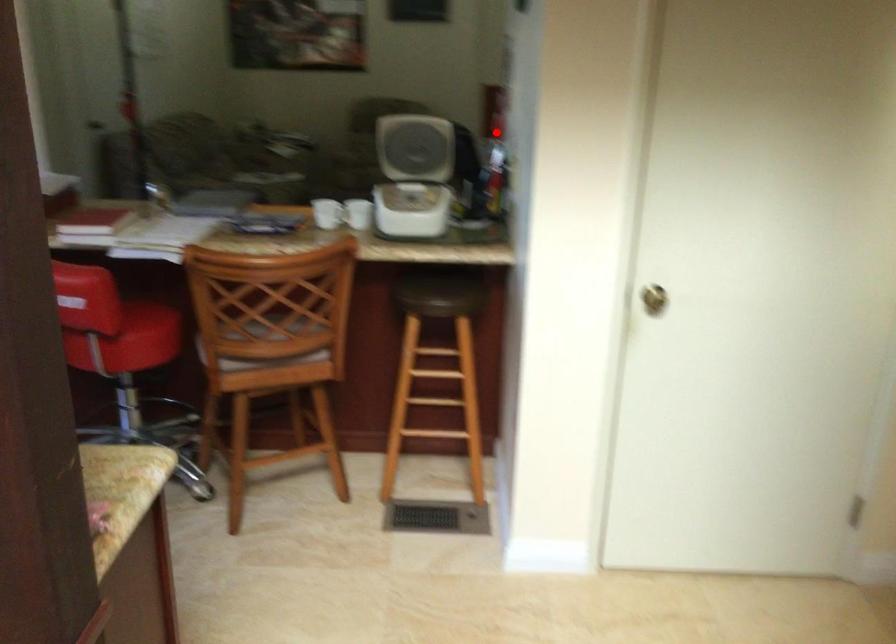
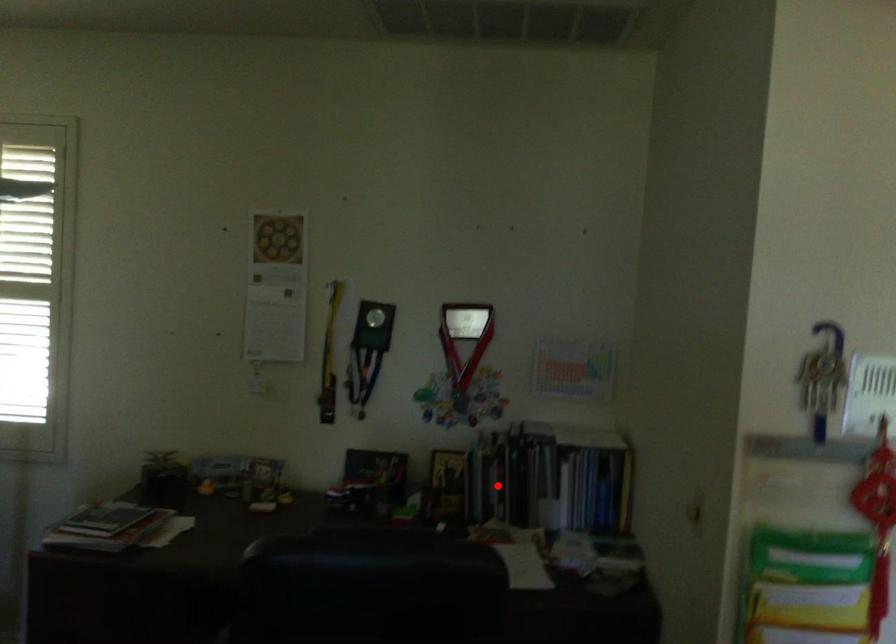
I am providing you with two images of the same scene from different viewpoints. A red point is marked on the first image and another point is marked on the second image. Is the marked point in image1 the same physical position as the marked point in image2?

No